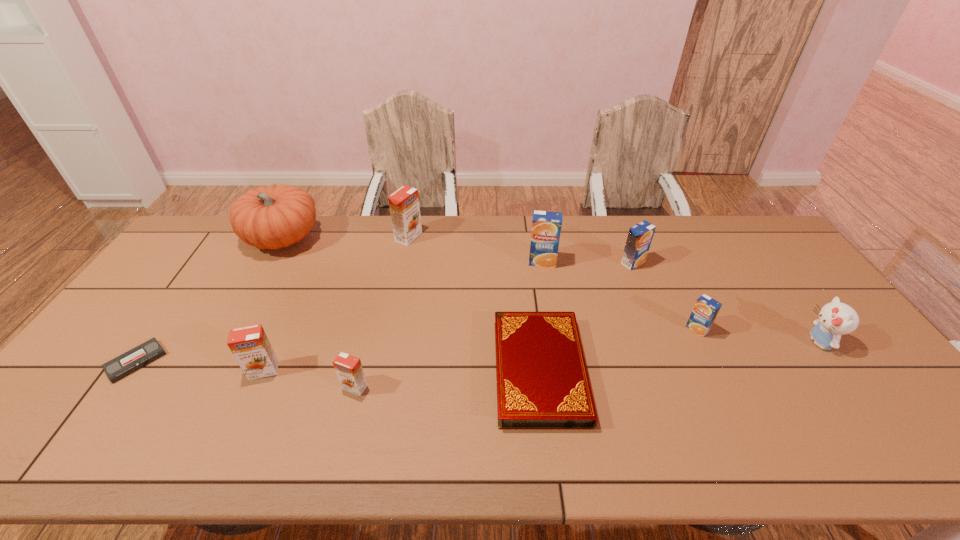
Locate an element on the screen. This screenshot has height=540, width=960. free space between the leftmost blue orange_juice and the smallest orange orange juice is located at coordinates (448, 325).

I want to click on empty space between the biggest orange orange juice and the leftmost orange orange juice, so click(x=336, y=303).

The height and width of the screenshot is (540, 960). Find the location of `free space between the shortest object and the orange pumpkin`. free space between the shortest object and the orange pumpkin is located at coordinates pyautogui.click(x=209, y=300).

At what (x,y) coordinates should I click in order to perform the action: click on free point between the second smallest orange orange juice and the biggest blue orange_juice. Please return your answer as a coordinate pair (x, y). Looking at the image, I should click on pos(403,316).

You are a GUI agent. You are given a task and a screenshot of the screen. Output one action in this format:
    pyautogui.click(x=<x>, y=<y>)
    Task: Click on the free spot between the pumpkin and the second object from right to left
    The image size is (960, 540).
    Given the screenshot: What is the action you would take?
    pyautogui.click(x=491, y=284)

This screenshot has width=960, height=540. Find the location of `free space between the third orange juice from right to left and the second smallest orange orange juice`. free space between the third orange juice from right to left and the second smallest orange orange juice is located at coordinates (403, 316).

Where is `vacant point located between the leftmost blue orange_juice and the farthest orange juice`? vacant point located between the leftmost blue orange_juice and the farthest orange juice is located at coordinates (475, 249).

At what (x,y) coordinates should I click in order to perform the action: click on the sixth closest object relative to the second smallest blue orange_juice. Please return your answer as a coordinate pair (x, y). Looking at the image, I should click on (348, 368).

I want to click on object identified as the second closest to the leftmost object, so click(273, 217).

This screenshot has height=540, width=960. Find the location of `orange juice that is the second nearest to the farthest orange juice`. orange juice that is the second nearest to the farthest orange juice is located at coordinates (250, 346).